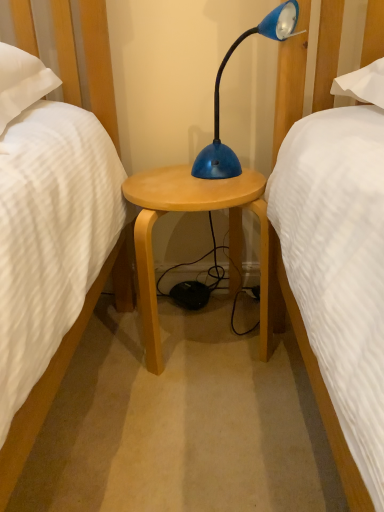
Question: Should I look upward or downward to see blue glossy desk lamp at center?

Choices:
 (A) up
 (B) down

Answer: (A)

Question: Is blue glossy desk lamp at center oriented towards light wood stool at center?

Choices:
 (A) no
 (B) yes

Answer: (A)

Question: From the image's perspective, is blue glossy desk lamp at center on top of light wood stool at center?

Choices:
 (A) yes
 (B) no

Answer: (A)

Question: Is light wood stool at center surrounded by blue glossy desk lamp at center?

Choices:
 (A) no
 (B) yes

Answer: (A)

Question: Does blue glossy desk lamp at center appear on the right side of light wood stool at center?

Choices:
 (A) yes
 (B) no

Answer: (A)

Question: Does blue glossy desk lamp at center lie in front of light wood stool at center?

Choices:
 (A) yes
 (B) no

Answer: (A)

Question: Considering the relative sizes of blue glossy desk lamp at center and light wood stool at center in the image provided, is blue glossy desk lamp at center taller than light wood stool at center?

Choices:
 (A) no
 (B) yes

Answer: (A)

Question: Does light wood stool at center touch blue glossy desk lamp at center?

Choices:
 (A) yes
 (B) no

Answer: (B)

Question: Considering the relative sizes of light wood stool at center and blue glossy desk lamp at center in the image provided, is light wood stool at center smaller than blue glossy desk lamp at center?

Choices:
 (A) yes
 (B) no

Answer: (B)

Question: Is light wood stool at center not close to blue glossy desk lamp at center?

Choices:
 (A) no
 (B) yes

Answer: (A)

Question: From a real-world perspective, is light wood stool at center on blue glossy desk lamp at center?

Choices:
 (A) no
 (B) yes

Answer: (A)

Question: From the image's perspective, is light wood stool at center under blue glossy desk lamp at center?

Choices:
 (A) no
 (B) yes

Answer: (B)

Question: Considering the relative sizes of light wood stool at center and blue glossy desk lamp at center in the image provided, is light wood stool at center taller than blue glossy desk lamp at center?

Choices:
 (A) no
 (B) yes

Answer: (B)

Question: In terms of size, does light wood stool at center appear bigger or smaller than blue glossy desk lamp at center?

Choices:
 (A) big
 (B) small

Answer: (A)